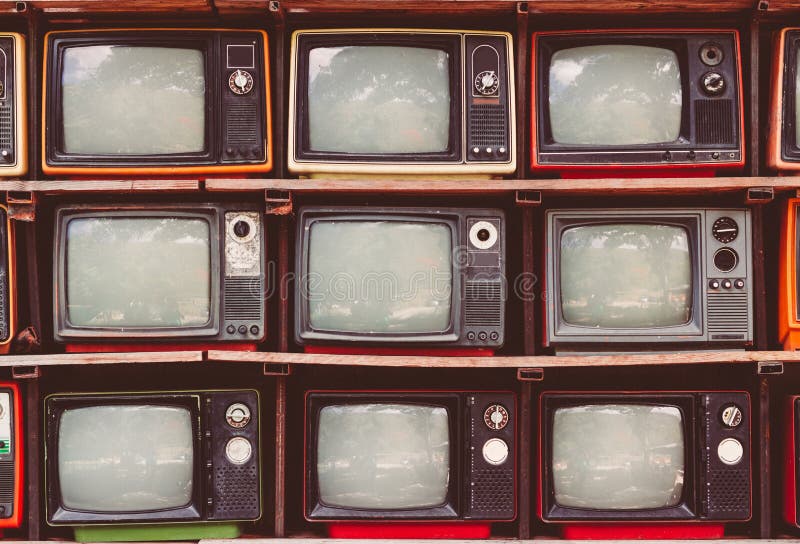
Where is `screens`? The width and height of the screenshot is (800, 544). screens is located at coordinates (157, 478), (377, 456), (576, 460), (636, 259), (340, 276), (148, 246), (136, 98), (376, 125), (586, 129).